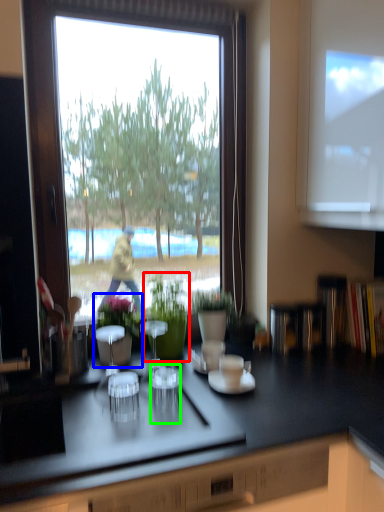
Question: Based on their relative distances, which object is farther from houseplant (highlighted by a red box)? Choose from houseplant (highlighted by a blue box) and shot glass (highlighted by a green box).

Choices:
 (A) houseplant
 (B) shot glass

Answer: (B)